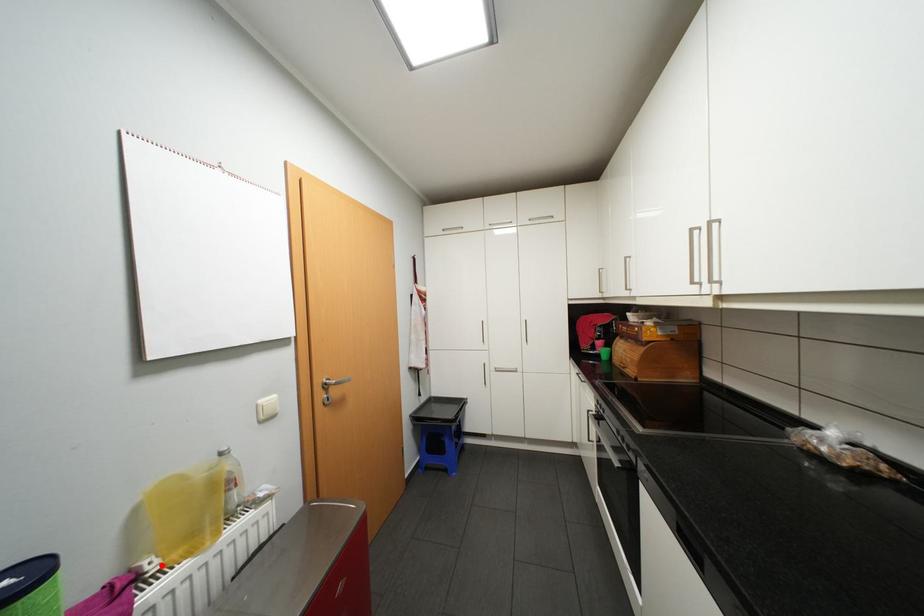
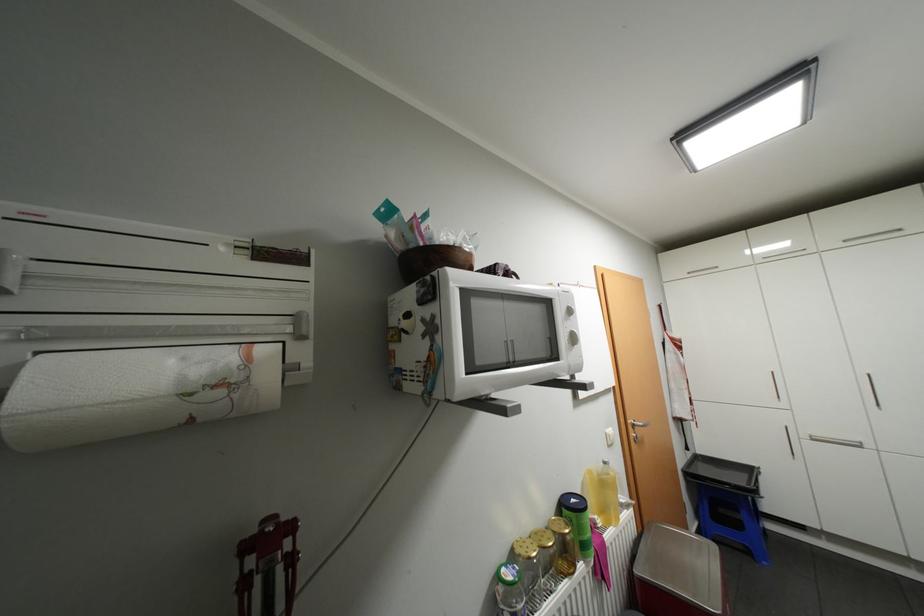
Find the pixel in the second image that matches the highlighted location in the first image.

(606, 521)